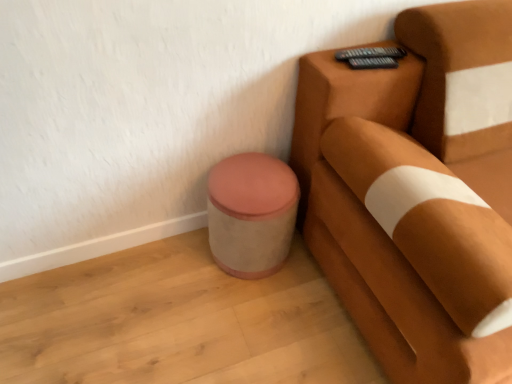
Identify the location of pink fabric ottoman at lower left. This screenshot has height=384, width=512. (251, 214).

Describe the element at coordinates (251, 214) in the screenshot. I see `pink fabric ottoman at lower left` at that location.

In order to face suede brown armchair at right, should I rotate leftwards or rightwards?

It's best to rotate right around 32.714 degrees.

Locate an element on the screen. This screenshot has height=384, width=512. suede brown armchair at right is located at coordinates (417, 192).

This screenshot has height=384, width=512. What do you see at coordinates (417, 192) in the screenshot? I see `suede brown armchair at right` at bounding box center [417, 192].

Identify the location of pink fabric ottoman at lower left. (251, 214).

Considering the positions of objects suede brown armchair at right and pink fabric ottoman at lower left in the image provided, who is more to the right, suede brown armchair at right or pink fabric ottoman at lower left?

suede brown armchair at right.

Considering the positions of objects suede brown armchair at right and pink fabric ottoman at lower left in the image provided, who is in front, suede brown armchair at right or pink fabric ottoman at lower left?

suede brown armchair at right is more forward.

Between point (382, 154) and point (276, 236), which one is positioned behind?

Positioned behind is point (276, 236).

From the image's perspective, which is below, suede brown armchair at right or pink fabric ottoman at lower left?

pink fabric ottoman at lower left appears lower in the image.

From a real-world perspective, is suede brown armchair at right under pink fabric ottoman at lower left?

Actually, suede brown armchair at right is physically above pink fabric ottoman at lower left in the real world.

Can you confirm if suede brown armchair at right is wider than pink fabric ottoman at lower left?

Yes, suede brown armchair at right is wider than pink fabric ottoman at lower left.

In terms of height, does suede brown armchair at right look taller or shorter compared to pink fabric ottoman at lower left?

Considering their sizes, suede brown armchair at right has more height than pink fabric ottoman at lower left.

Looking at the image, does suede brown armchair at right seem bigger or smaller compared to pink fabric ottoman at lower left?

In the image, suede brown armchair at right appears to be larger than pink fabric ottoman at lower left.

Is suede brown armchair at right inside or outside of pink fabric ottoman at lower left?

→ suede brown armchair at right exists outside the volume of pink fabric ottoman at lower left.

Is suede brown armchair at right next to pink fabric ottoman at lower left?

No, suede brown armchair at right is not in contact with pink fabric ottoman at lower left.

Is suede brown armchair at right aimed at pink fabric ottoman at lower left?

No.

How many degrees apart are the facing directions of suede brown armchair at right and pink fabric ottoman at lower left?

The angle between the facing direction of suede brown armchair at right and the facing direction of pink fabric ottoman at lower left is 1.19 degrees.

How far apart are suede brown armchair at right and pink fabric ottoman at lower left?

suede brown armchair at right and pink fabric ottoman at lower left are 14.44 inches apart from each other.

Locate an element on the screen. This screenshot has width=512, height=384. furniture above the pink fabric ottoman at lower left (from a real-world perspective) is located at coordinates (417, 192).

Can you confirm if pink fabric ottoman at lower left is positioned to the right of suede brown armchair at right?

No.

Does pink fabric ottoman at lower left lie behind suede brown armchair at right?

Yes, it is behind suede brown armchair at right.

Which point is more forward, (237, 254) or (320, 141)?

The point (320, 141) is in front.

From the image's perspective, between pink fabric ottoman at lower left and suede brown armchair at right, who is located below?

From the image's view, pink fabric ottoman at lower left is below.

From a real-world perspective, who is located higher, pink fabric ottoman at lower left or suede brown armchair at right?

From a 3D spatial view, suede brown armchair at right is above.

Does pink fabric ottoman at lower left have a lesser width compared to suede brown armchair at right?

Yes, pink fabric ottoman at lower left is thinner than suede brown armchair at right.

Consider the image. Is pink fabric ottoman at lower left taller or shorter than suede brown armchair at right?

Clearly, pink fabric ottoman at lower left is shorter compared to suede brown armchair at right.

Based on their sizes in the image, would you say pink fabric ottoman at lower left is bigger or smaller than suede brown armchair at right?

In the image, pink fabric ottoman at lower left appears to be smaller than suede brown armchair at right.

Would you say pink fabric ottoman at lower left is outside suede brown armchair at right?

That's correct, pink fabric ottoman at lower left is outside of suede brown armchair at right.

Is pink fabric ottoman at lower left not close to suede brown armchair at right?

pink fabric ottoman at lower left is actually quite close to suede brown armchair at right.

Looking at this image, is suede brown armchair at right at the back of pink fabric ottoman at lower left?

No, pink fabric ottoman at lower left's orientation is not away from suede brown armchair at right.

What's the angular difference between pink fabric ottoman at lower left and suede brown armchair at right's facing directions?

The facing directions of pink fabric ottoman at lower left and suede brown armchair at right are 1.19 degrees apart.

How distant is pink fabric ottoman at lower left from suede brown armchair at right?

14.44 inches.

Where is `furniture lying above the pink fabric ottoman at lower left (from the image's perspective)`? This screenshot has height=384, width=512. furniture lying above the pink fabric ottoman at lower left (from the image's perspective) is located at coordinates (417, 192).

Find the location of a particular element. The width and height of the screenshot is (512, 384). potty behind the suede brown armchair at right is located at coordinates (251, 214).

This screenshot has height=384, width=512. Find the location of `potty on the left of suede brown armchair at right`. potty on the left of suede brown armchair at right is located at coordinates (251, 214).